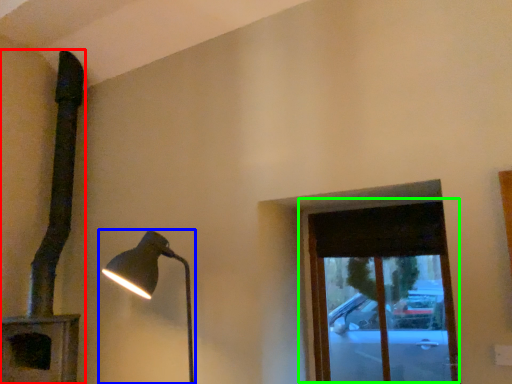
Question: Estimate the real-world distances between objects in this image. Which object is farther from lamp (highlighted by a red box), lamp (highlighted by a blue box) or window (highlighted by a green box)?

Choices:
 (A) lamp
 (B) window

Answer: (B)